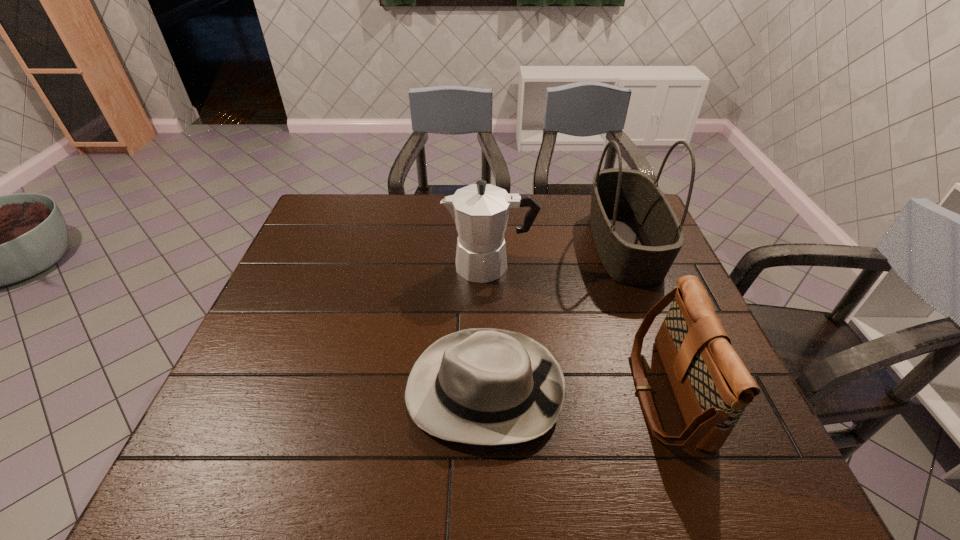
Locate an element on the screen. The width and height of the screenshot is (960, 540). object at the near right corner is located at coordinates (712, 386).

This screenshot has height=540, width=960. I want to click on free space at the far edge of the desktop, so click(x=362, y=212).

Where is `free spot at the near edge of the desktop`? This screenshot has width=960, height=540. free spot at the near edge of the desktop is located at coordinates (540, 471).

In the image, there is a desktop. Where is `vacant space at the left edge`? vacant space at the left edge is located at coordinates (232, 369).

Find the location of a particular element. Image resolution: width=960 pixels, height=540 pixels. blank space at the far left corner is located at coordinates (340, 212).

Identify the location of free spot between the second shortest object and the coffeepot. The image size is (960, 540). (578, 329).

Where is `empty space between the basket and the shortest object`? This screenshot has width=960, height=540. empty space between the basket and the shortest object is located at coordinates (554, 316).

The image size is (960, 540). Identify the location of vacant space that's between the second tallest object and the fedora. (487, 327).

Locate an element on the screen. The image size is (960, 540). free space between the third shortest object and the basket is located at coordinates (557, 255).

Locate an element on the screen. Image resolution: width=960 pixels, height=540 pixels. free spot between the second tallest object and the shortest object is located at coordinates (487, 327).